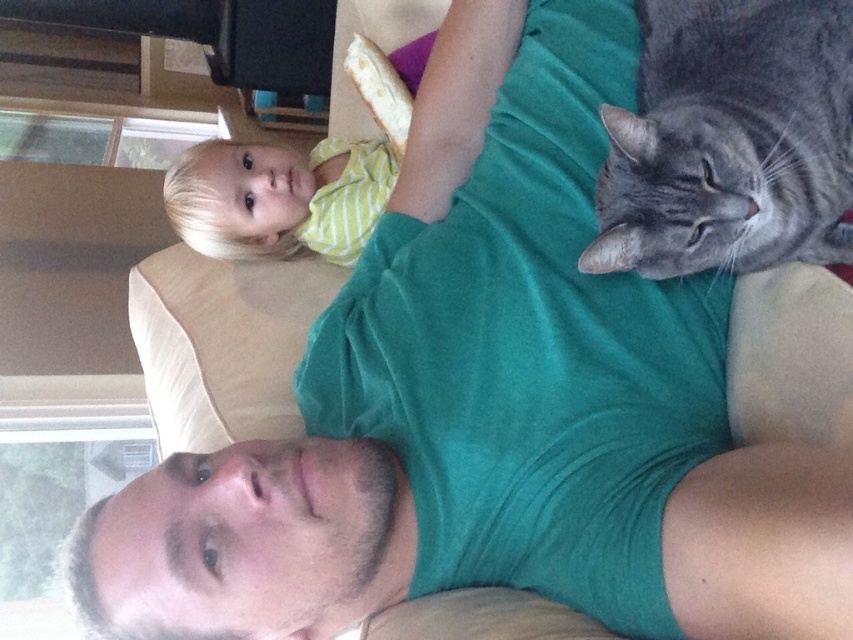
Can you confirm if gray tabby cat at upper right is positioned below yellow striped shirt at upper left?

Indeed, gray tabby cat at upper right is positioned under yellow striped shirt at upper left.

What are the coordinates of `gray tabby cat at upper right` in the screenshot? It's located at (730, 140).

Is point (717, 150) closer to viewer compared to point (190, 208)?

Yes, point (717, 150) is in front of point (190, 208).

Find the location of a particular element. gray tabby cat at upper right is located at coordinates (730, 140).